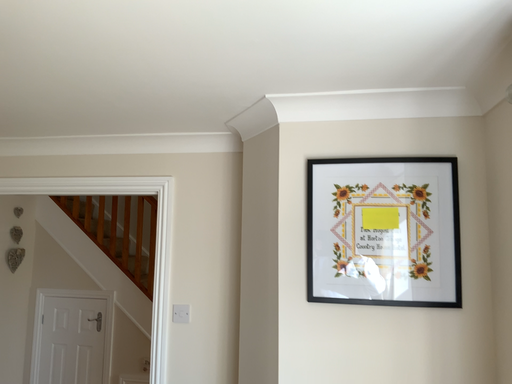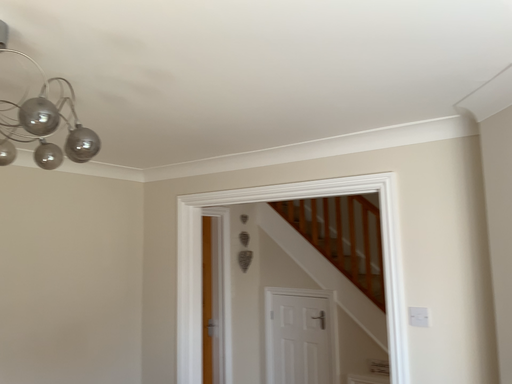
Question: How did the camera likely rotate when shooting the video?

Choices:
 (A) rotated left
 (B) rotated right

Answer: (A)